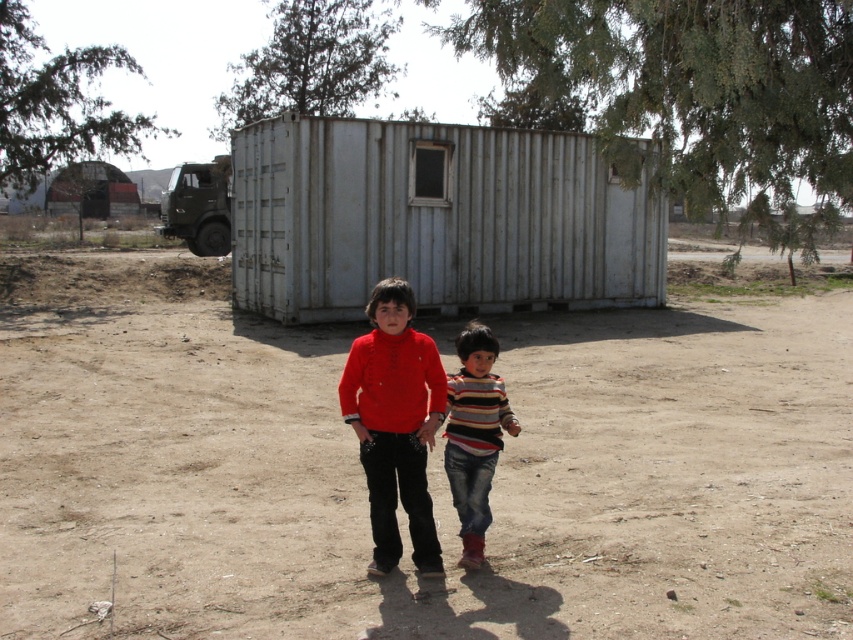
Which is above, white corrugated metal container at center or striped fabric shirt at center?

white corrugated metal container at center

The height and width of the screenshot is (640, 853). In order to click on white corrugated metal container at center in this screenshot , I will do `click(434, 220)`.

Is brown sandy dirt at center bigger than matte red shirt at center?

Yes, brown sandy dirt at center is bigger than matte red shirt at center.

Where is `brown sandy dirt at center`? This screenshot has width=853, height=640. brown sandy dirt at center is located at coordinates (428, 468).

Locate an element on the screen. brown sandy dirt at center is located at coordinates (428, 468).

Is point (436, 266) farther from viewer compared to point (77, 198)?

That is False.

Is white corrugated metal container at center wider than rustic corrugated metal hut at upper center?

In fact, white corrugated metal container at center might be narrower than rustic corrugated metal hut at upper center.

Locate an element on the screen. This screenshot has height=640, width=853. white corrugated metal container at center is located at coordinates (434, 220).